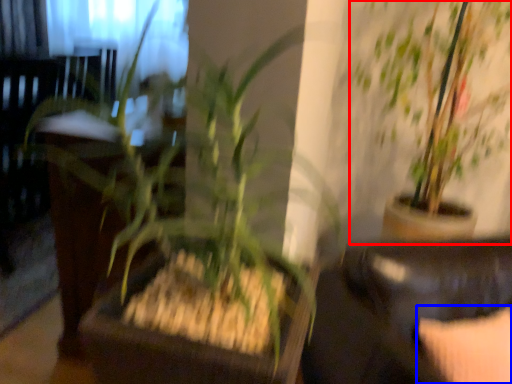
Question: Which object appears farthest to the camera in this image, houseplant (highlighted by a red box) or pillow (highlighted by a blue box)?

Choices:
 (A) houseplant
 (B) pillow

Answer: (A)